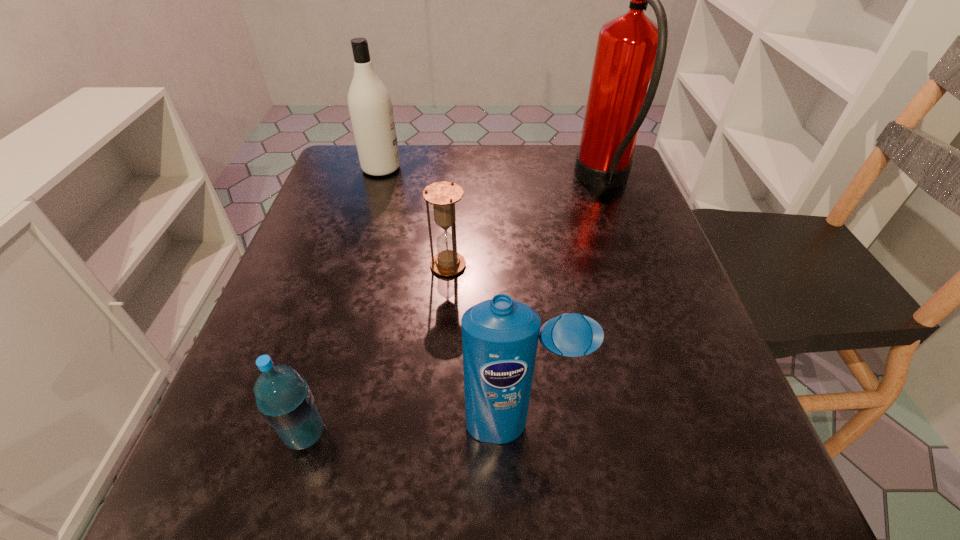
Locate an element on the screen. The width and height of the screenshot is (960, 540). vacant space at the far edge of the desktop is located at coordinates (444, 151).

The width and height of the screenshot is (960, 540). What are the coordinates of `free space at the near edge` in the screenshot? It's located at (400, 460).

The width and height of the screenshot is (960, 540). I want to click on vacant space at the left edge of the desktop, so click(x=305, y=251).

Find the location of a particular element. The image size is (960, 540). vacant space at the right edge of the desktop is located at coordinates (703, 446).

In order to click on free space at the far left corner of the desktop in this screenshot , I will do `click(370, 195)`.

This screenshot has width=960, height=540. Identify the location of free point at the near left corner. (216, 476).

This screenshot has width=960, height=540. In the image, there is a desktop. In order to click on vacant space at the far right corner in this screenshot , I will do `click(562, 152)`.

Find the location of a particular element. vacant area that lies between the second object from right to left and the farther shampoo is located at coordinates (450, 297).

This screenshot has width=960, height=540. Identify the location of empty space that is in between the fire extinguisher and the fourth object from left to right. (562, 304).

The height and width of the screenshot is (540, 960). I want to click on free space that is in between the third object from left to right and the fire extinguisher, so click(x=526, y=224).